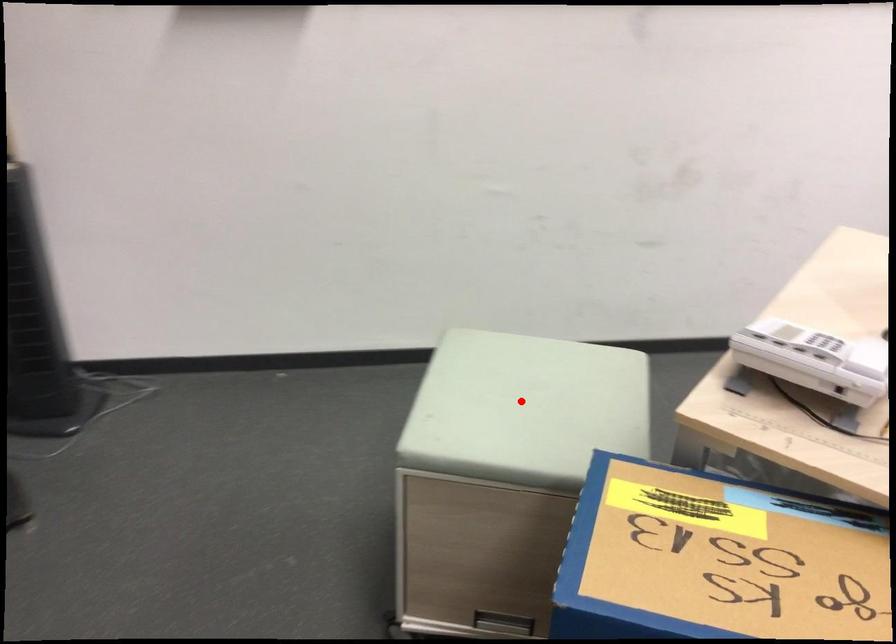
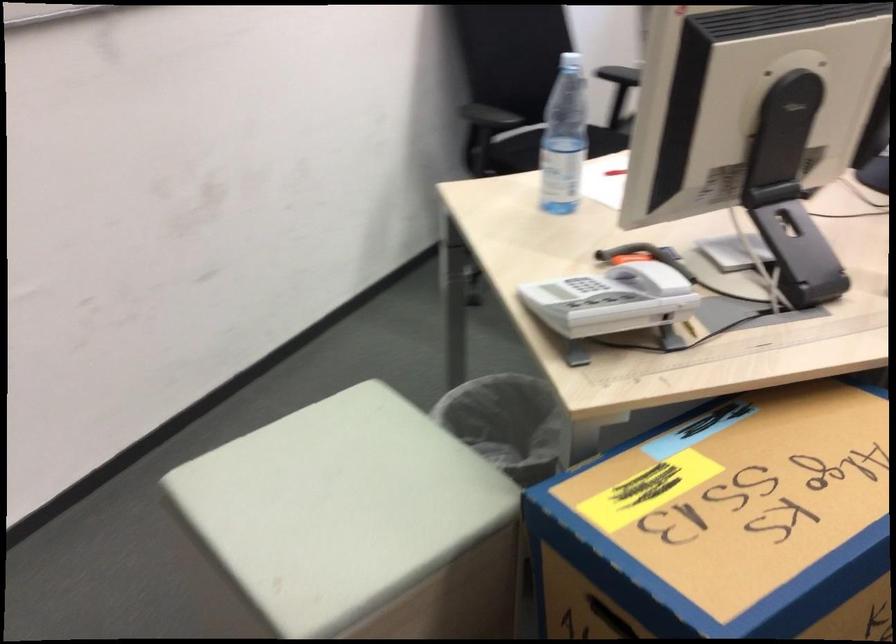
Where in the second image is the point corresponding to the highlighted location from the first image?

(339, 502)